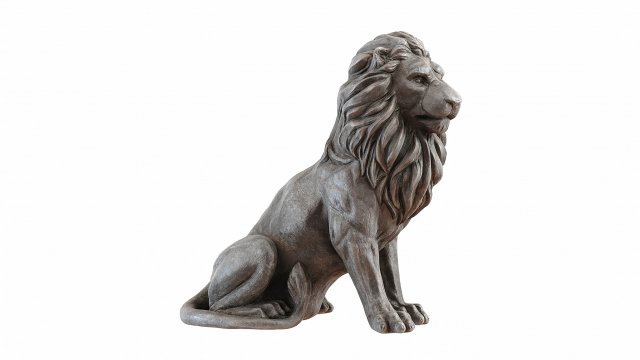
This screenshot has height=360, width=640. Identify the location of sculpture. (358, 182).